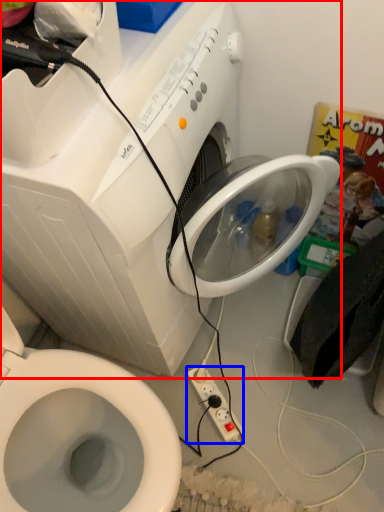
Question: Which of the following is the farthest to the observer, washing machine (highlighted by a red box) or power plugs and sockets (highlighted by a blue box)?

Choices:
 (A) washing machine
 (B) power plugs and sockets

Answer: (B)